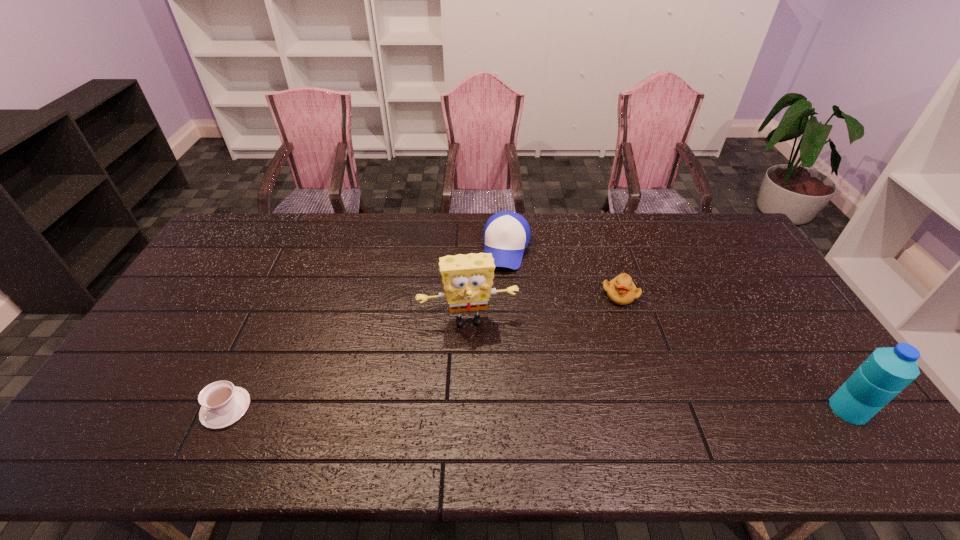
This screenshot has width=960, height=540. I want to click on vacant space located on the face of the sponge, so click(x=479, y=369).

Where is `object located in the far edge section of the desktop`? object located in the far edge section of the desktop is located at coordinates (506, 234).

Image resolution: width=960 pixels, height=540 pixels. I want to click on teacup that is at the near edge, so click(222, 404).

You are a GUI agent. You are given a task and a screenshot of the screen. Output one action in this format:
    pyautogui.click(x=<x>, y=<y>)
    Task: Click on the water bottle at the near edge
    This screenshot has height=540, width=960.
    Given the screenshot: What is the action you would take?
    pyautogui.click(x=887, y=371)

Where is `object at the right edge`? object at the right edge is located at coordinates (887, 371).

Image resolution: width=960 pixels, height=540 pixels. What are the coordinates of `object that is positioned at the near right corner` in the screenshot? It's located at (887, 371).

At what (x,y) coordinates should I click in order to perform the action: click on vacant area at the far edge. Please return your answer as a coordinate pair (x, y). The image size is (960, 540). Looking at the image, I should click on (571, 214).

The height and width of the screenshot is (540, 960). In order to click on free space at the near edge of the desktop in this screenshot , I will do `click(199, 403)`.

In the image, there is a desktop. Where is `vacant space at the left edge`? vacant space at the left edge is located at coordinates (243, 271).

The image size is (960, 540). In the image, there is a desktop. In order to click on vacant area at the far left corner in this screenshot , I will do `click(273, 215)`.